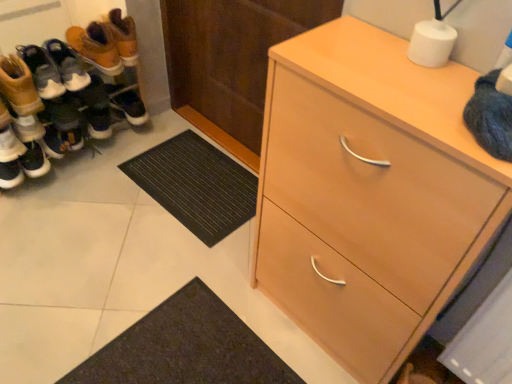
Locate an element on the screen. The height and width of the screenshot is (384, 512). leather boots at left, which is counted as the fourth footwear, starting from the back is located at coordinates (19, 86).

This screenshot has width=512, height=384. What do you see at coordinates (72, 92) in the screenshot?
I see `leather boots at left, the second footwear viewed from the front` at bounding box center [72, 92].

What do you see at coordinates (196, 185) in the screenshot? Image resolution: width=512 pixels, height=384 pixels. I see `black rubber doormat at lower center` at bounding box center [196, 185].

Describe the element at coordinates (231, 55) in the screenshot. I see `wooden door at center` at that location.

This screenshot has height=384, width=512. I want to click on light wood cabinet at right, so click(x=369, y=193).

Is the depth of black rubber doormat at lower center greater than that of matte black shoes at left, the first footwear in the back-to-front sequence?

That is True.

Is matte black shoes at left, the fourth footwear in the front-to-back sequence, at the back of black rubber doormat at lower center?

No, black rubber doormat at lower center is not facing away from matte black shoes at left, the fourth footwear in the front-to-back sequence.

You are a GUI agent. You are given a task and a screenshot of the screen. Output one action in this format:
    pyautogui.click(x=<x>, y=<y>)
    Task: Click on the 4th footwear above the black rubber doormat at lower center (from the image's perspective)
    This screenshot has height=384, width=512.
    Given the screenshot: What is the action you would take?
    pyautogui.click(x=96, y=47)

Locate an element on the screen. The image size is (512, 384). door located in front of the matte black shoes at left, the fourth footwear in the front-to-back sequence is located at coordinates (231, 55).

From the picture: Is matte black shoes at left, the fourth footwear in the front-to-back sequence, wider or thinner than wooden door at center?

In the image, matte black shoes at left, the fourth footwear in the front-to-back sequence, appears to be wider than wooden door at center.

From a real-world perspective, which is physically above, matte black shoes at left, the first footwear in the back-to-front sequence, or wooden door at center?

matte black shoes at left, the first footwear in the back-to-front sequence, is physically above.

Who is shorter, matte black shoes at left, the fourth footwear in the front-to-back sequence, or wooden door at center?

With less height is matte black shoes at left, the fourth footwear in the front-to-back sequence.

Considering the sizes of black rubber doormat at lower center and light wood cabinet at right in the image, is black rubber doormat at lower center bigger or smaller than light wood cabinet at right?

Clearly, black rubber doormat at lower center is smaller in size than light wood cabinet at right.

In the scene shown: Which of these two, black rubber doormat at lower center or light wood cabinet at right, is thinner?

With smaller width is light wood cabinet at right.

Which is behind, black rubber doormat at lower center or light wood cabinet at right?

black rubber doormat at lower center is further away from the camera.

What's the angular difference between black rubber doormat at lower center and light wood cabinet at right's facing directions?

1.88 degrees.

Could you measure the distance between matte black shoes at left, the first footwear in the back-to-front sequence, and matte white sneaker at left, placed as the 3th footwear when sorted from front to back?

A distance of 43.53 centimeters exists between matte black shoes at left, the first footwear in the back-to-front sequence, and matte white sneaker at left, placed as the 3th footwear when sorted from front to back.

From the image's perspective, between matte black shoes at left, the first footwear in the back-to-front sequence, and matte white sneaker at left, which is counted as the second footwear, starting from the back, who is located below?

matte white sneaker at left, which is counted as the second footwear, starting from the back.

Is matte black shoes at left, the first footwear in the back-to-front sequence, facing towards matte white sneaker at left, placed as the 3th footwear when sorted from front to back?

No, matte black shoes at left, the first footwear in the back-to-front sequence, is not aimed at matte white sneaker at left, placed as the 3th footwear when sorted from front to back.

From a real-world perspective, count 2nd footwears downward from the matte black shoes at left, the fourth footwear in the front-to-back sequence, and point to it. Please provide its 2D coordinates.

[(10, 145)]

Does matte white sneaker at left, which is counted as the second footwear, starting from the back, appear on the right side of leather boots at left, the third footwear when ordered from back to front?

No, matte white sneaker at left, which is counted as the second footwear, starting from the back, is not to the right of leather boots at left, the third footwear when ordered from back to front.

Is matte white sneaker at left, which is counted as the second footwear, starting from the back, looking in the opposite direction of leather boots at left, the third footwear when ordered from back to front?

Yes.

Does matte white sneaker at left, placed as the 3th footwear when sorted from front to back, have a larger size compared to leather boots at left, the second footwear viewed from the front?

No.

Between matte white sneaker at left, which is counted as the second footwear, starting from the back, and leather boots at left, the third footwear when ordered from back to front, which one has more height?

leather boots at left, the third footwear when ordered from back to front, is taller.

Would you say matte white sneaker at left, which is counted as the second footwear, starting from the back, is to the left or to the right of matte black shoes at left, the first footwear in the back-to-front sequence, in the picture?

matte white sneaker at left, which is counted as the second footwear, starting from the back, is positioned on matte black shoes at left, the first footwear in the back-to-front sequence,'s left side.

Can you tell me how much matte white sneaker at left, placed as the 3th footwear when sorted from front to back, and matte black shoes at left, the first footwear in the back-to-front sequence, differ in facing direction?

There is a 0.959-degree angle between the facing directions of matte white sneaker at left, placed as the 3th footwear when sorted from front to back, and matte black shoes at left, the first footwear in the back-to-front sequence.

Can you confirm if matte white sneaker at left, which is counted as the second footwear, starting from the back, is shorter than matte black shoes at left, the fourth footwear in the front-to-back sequence?

Yes, matte white sneaker at left, which is counted as the second footwear, starting from the back, is shorter than matte black shoes at left, the fourth footwear in the front-to-back sequence.

Who is taller, matte white sneaker at left, placed as the 3th footwear when sorted from front to back, or leather boots at left, which is counted as the fourth footwear, starting from the back?

leather boots at left, which is counted as the fourth footwear, starting from the back, is taller.

Is matte white sneaker at left, which is counted as the second footwear, starting from the back, aimed at leather boots at left, the first footwear positioned from the front?

No, matte white sneaker at left, which is counted as the second footwear, starting from the back, is not oriented towards leather boots at left, the first footwear positioned from the front.

From the image's perspective, is matte white sneaker at left, placed as the 3th footwear when sorted from front to back, located beneath leather boots at left, the first footwear positioned from the front?

Correct, matte white sneaker at left, placed as the 3th footwear when sorted from front to back, appears lower than leather boots at left, the first footwear positioned from the front, in the image.

At what (x,y) coordinates should I click in order to perform the action: click on doormat behind the matte black shoes at left, the first footwear in the back-to-front sequence. Please return your answer as a coordinate pair (x, y). This screenshot has height=384, width=512. Looking at the image, I should click on (196, 185).

Image resolution: width=512 pixels, height=384 pixels. What are the coordinates of `footwear that is the 2nd object above the wooden door at center (from a real-world perspective)` in the screenshot? It's located at (96, 47).

From the image, which object appears to be farther from leather boots at left, the second footwear viewed from the front, light wood cabinet at right or leather boots at left, which is counted as the fourth footwear, starting from the back?

Based on the image, light wood cabinet at right appears to be further to leather boots at left, the second footwear viewed from the front.

Which object lies further to the anchor point leather boots at left, the first footwear positioned from the front, black rubber doormat at lower center or matte white sneaker at left, placed as the 3th footwear when sorted from front to back?

black rubber doormat at lower center lies further to leather boots at left, the first footwear positioned from the front, than the other object.

Considering their positions, is black rubber doormat at lower center positioned closer to matte black shoes at left, the fourth footwear in the front-to-back sequence, than wooden door at center?

Among the two, wooden door at center is located nearer to matte black shoes at left, the fourth footwear in the front-to-back sequence.

Looking at the image, which one is located closer to wooden door at center, light wood cabinet at right or leather boots at left, which is counted as the fourth footwear, starting from the back?

leather boots at left, which is counted as the fourth footwear, starting from the back.

When comparing their distances from light wood cabinet at right, does leather boots at left, the third footwear when ordered from back to front, or matte black shoes at left, the fourth footwear in the front-to-back sequence, seem further?

Based on the image, matte black shoes at left, the fourth footwear in the front-to-back sequence, appears to be further to light wood cabinet at right.

Consider the image. Based on their spatial positions, is matte white sneaker at left, which is counted as the second footwear, starting from the back, or matte black shoes at left, the first footwear in the back-to-front sequence, further from black rubber doormat at lower center?

The object further to black rubber doormat at lower center is matte white sneaker at left, which is counted as the second footwear, starting from the back.

From the image, which object appears to be nearer to black rubber doormat at lower center, leather boots at left, the first footwear positioned from the front, or wooden door at center?

wooden door at center.

Consider the image. Which object lies further to the anchor point black rubber doormat at lower center, matte black shoes at left, the fourth footwear in the front-to-back sequence, or light wood cabinet at right?

light wood cabinet at right lies further to black rubber doormat at lower center than the other object.

Find the location of a particular element. This screenshot has height=384, width=512. doormat situated between leather boots at left, the third footwear when ordered from back to front, and light wood cabinet at right from left to right is located at coordinates (196, 185).

At what (x,y) coordinates should I click in order to perform the action: click on footwear between leather boots at left, the third footwear when ordered from back to front, and black rubber doormat at lower center from left to right. Please return your answer as a coordinate pair (x, y). This screenshot has height=384, width=512. Looking at the image, I should click on (96, 47).

Where is `doormat between leather boots at left, the third footwear when ordered from back to front, and wooden door at center`? This screenshot has width=512, height=384. doormat between leather boots at left, the third footwear when ordered from back to front, and wooden door at center is located at coordinates (196, 185).

The height and width of the screenshot is (384, 512). What are the coordinates of `doormat between matte black shoes at left, the fourth footwear in the front-to-back sequence, and wooden door at center, in the horizontal direction` in the screenshot? It's located at (196, 185).